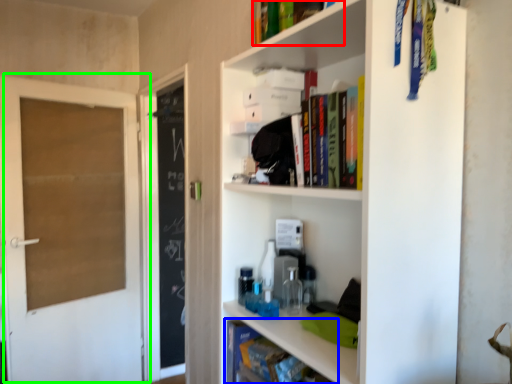
Question: Estimate the real-world distances between objects in this image. Which object is closer to book (highlighted by a red box), book (highlighted by a blue box) or door (highlighted by a green box)?

Choices:
 (A) book
 (B) door

Answer: (A)